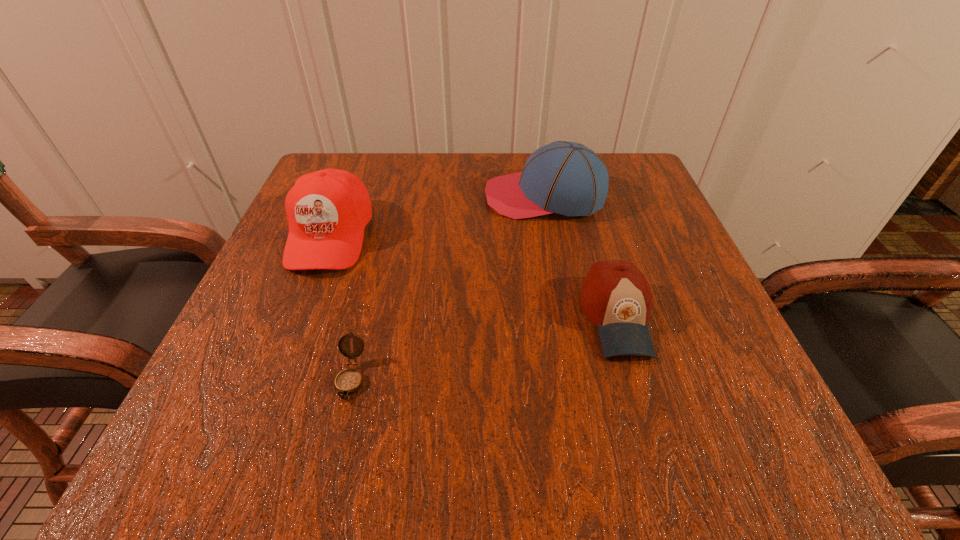
The image size is (960, 540). I want to click on empty location between the third object from right to left and the nearest baseball cap, so click(x=484, y=348).

This screenshot has height=540, width=960. What are the coordinates of `free space between the leftmost object and the third tallest object` in the screenshot? It's located at (473, 276).

Where is `empty space between the shortest object and the leftmost object`? empty space between the shortest object and the leftmost object is located at coordinates (341, 307).

Select which object appears as the third closest to the leftmost baseball cap. Please provide its 2D coordinates. Your answer should be formatted as a tuple, i.e. [(x, y)], where the tuple contains the x and y coordinates of a point satisfying the conditions above.

[(615, 296)]

In order to click on the second closest object relative to the compass in this screenshot , I will do `click(615, 296)`.

Identify the location of baseball cap that is the second closest to the compass. [615, 296].

What are the coordinates of `baseball cap that stands as the third closest to the shortest object` in the screenshot? It's located at (563, 177).